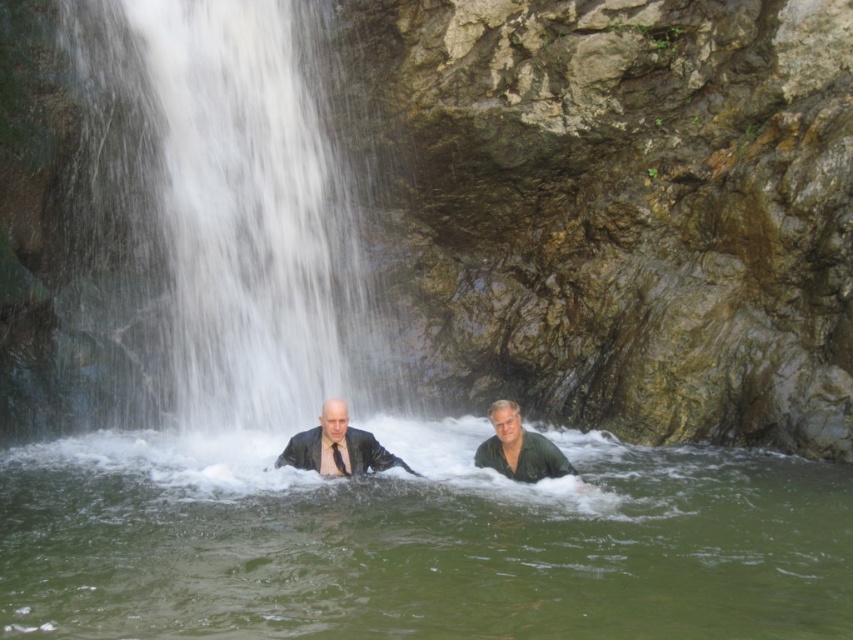
Image resolution: width=853 pixels, height=640 pixels. I want to click on white frothy water at center, so click(x=215, y=218).

Does white frothy water at center have a lesser height compared to dark green leather jacket at center?

Yes, white frothy water at center is shorter than dark green leather jacket at center.

Locate an element on the screen. This screenshot has width=853, height=640. white frothy water at center is located at coordinates pos(215,218).

Where is `white frothy water at center`? The width and height of the screenshot is (853, 640). white frothy water at center is located at coordinates (215, 218).

Who is positioned more to the left, dark green leather jacket at center or green matte shirt at center?

dark green leather jacket at center is more to the left.

Does dark green leather jacket at center appear on the left side of green matte shirt at center?

Indeed, dark green leather jacket at center is positioned on the left side of green matte shirt at center.

Is point (538, 436) farther from camera compared to point (502, 458)?

No.

The image size is (853, 640). In order to click on dark green leather jacket at center in this screenshot , I will do `click(337, 445)`.

Is white frothy water at center to the right of matte black suit at center from the viewer's perspective?

Incorrect, white frothy water at center is not on the right side of matte black suit at center.

Does white frothy water at center appear under matte black suit at center?

No.

This screenshot has width=853, height=640. Describe the element at coordinates (215, 218) in the screenshot. I see `white frothy water at center` at that location.

I want to click on white frothy water at center, so click(x=215, y=218).